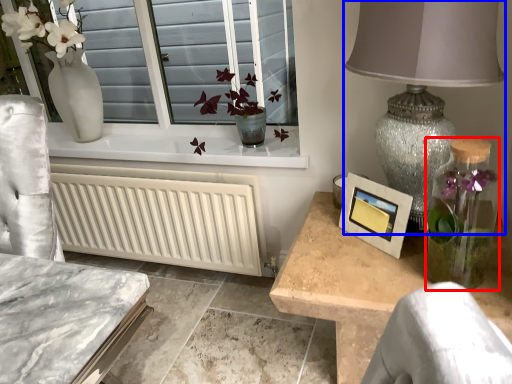
Question: Among these objects, which one is farthest to the camera, glass vase (highlighted by a red box) or table lamp (highlighted by a blue box)?

Choices:
 (A) glass vase
 (B) table lamp

Answer: (A)